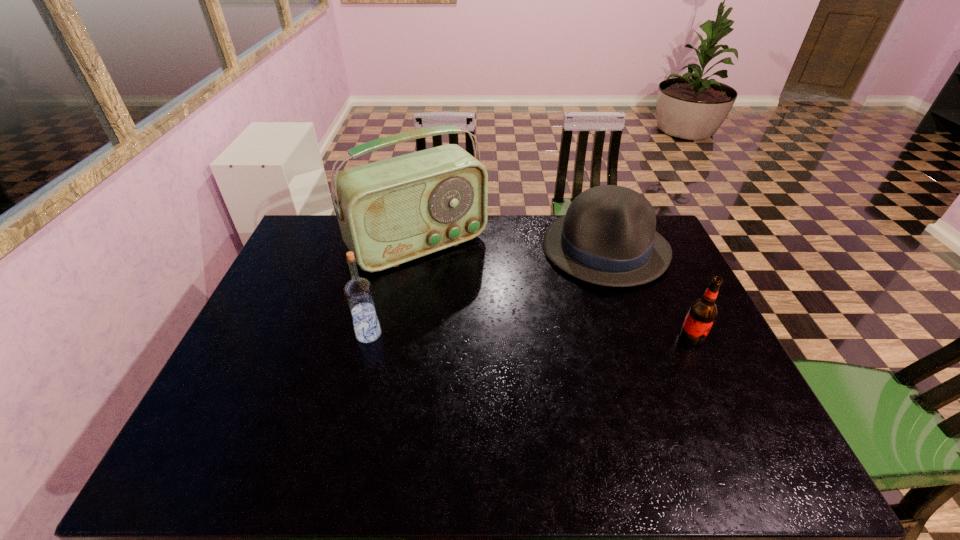
The width and height of the screenshot is (960, 540). Identify the location of free space located on the front panel of the tallest object. (495, 328).

This screenshot has height=540, width=960. In order to click on vacant position located on the front panel of the tallest object in this screenshot , I will do pos(459,284).

Identify the location of bowler hat located in the far edge section of the desktop. This screenshot has width=960, height=540. (607, 237).

Where is `radio receiver at the far edge`? This screenshot has width=960, height=540. radio receiver at the far edge is located at coordinates (392, 211).

This screenshot has height=540, width=960. I want to click on root beer present at the right edge, so click(x=702, y=313).

Find the location of a particular element. The height and width of the screenshot is (540, 960). bowler hat located at the right edge is located at coordinates (607, 237).

Where is `object that is at the far right corner`? The width and height of the screenshot is (960, 540). object that is at the far right corner is located at coordinates (607, 237).

This screenshot has width=960, height=540. I want to click on vacant space at the far edge of the desktop, so click(x=505, y=244).

Where is `vacant space at the near edge of the desktop`? Image resolution: width=960 pixels, height=540 pixels. vacant space at the near edge of the desktop is located at coordinates (479, 417).

The image size is (960, 540). I want to click on vacant region at the left edge, so click(x=283, y=295).